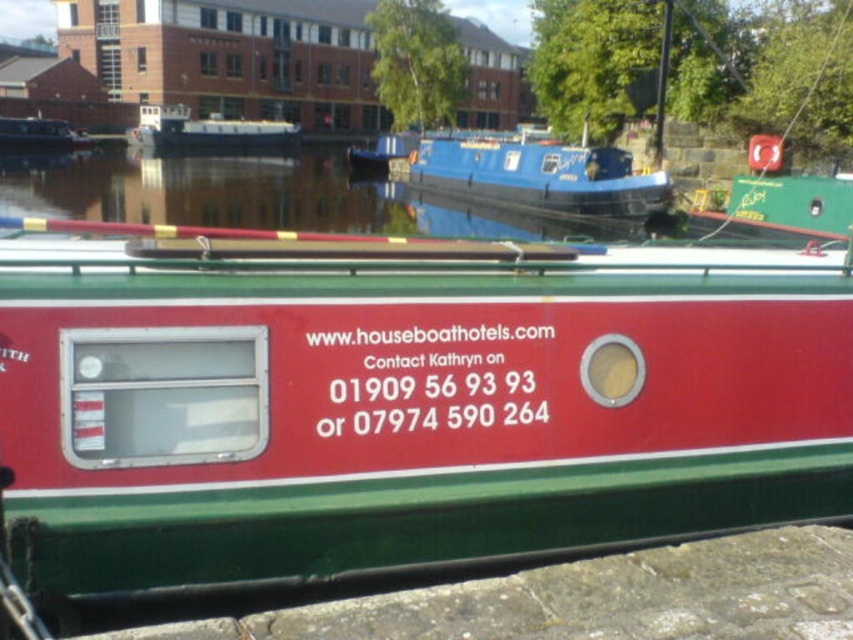
Is matte red boat at center wider than matte black boat at upper left?

Incorrect, matte red boat at center's width does not surpass matte black boat at upper left's.

Between matte red boat at center and matte black boat at upper left, which one appears on the right side from the viewer's perspective?

Positioned to the right is matte red boat at center.

Does point (53, 282) come in front of point (28, 120)?

Yes.

Image resolution: width=853 pixels, height=640 pixels. I want to click on matte red boat at center, so click(x=399, y=400).

Is white glossy houseboat at center closer to camera compared to matte black boat at upper left?

That is False.

Who is more forward, (252, 131) or (3, 134)?

Point (3, 134) is more forward.

Which is in front, point (271, 140) or point (35, 129)?

Positioned in front is point (35, 129).

Find the location of `white glossy houseboat at center`. white glossy houseboat at center is located at coordinates (206, 131).

In the scene shown: Which is more to the left, blue glossy houseboat at center or white glossy houseboat at center?

white glossy houseboat at center is more to the left.

Image resolution: width=853 pixels, height=640 pixels. I want to click on blue glossy houseboat at center, so click(x=521, y=172).

This screenshot has height=640, width=853. What are the coordinates of `blue glossy houseboat at center` in the screenshot? It's located at [521, 172].